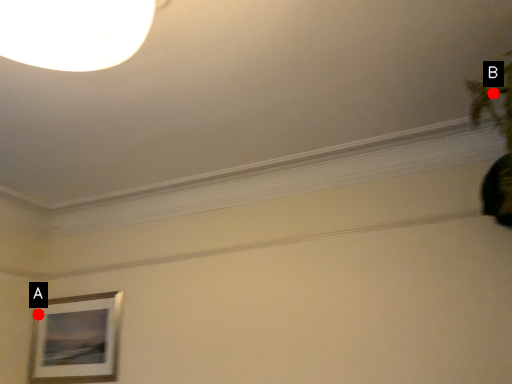
Question: Two points are circled on the image, labeled by A and B beside each circle. Which of the following is the farthest from the observer?

Choices:
 (A) A is further
 (B) B is further

Answer: (A)